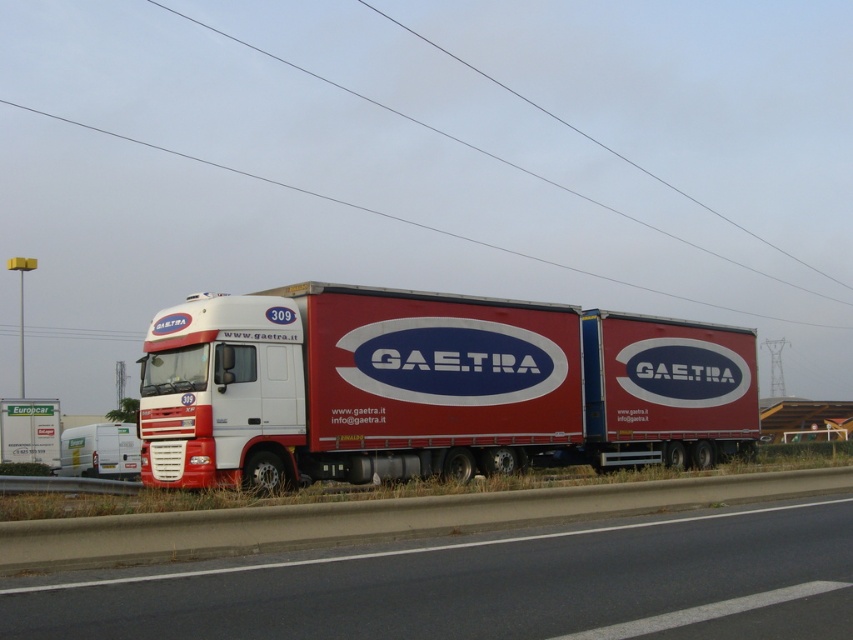
You are a delivery driver who needs to back up your vehicle into a loading dock. You see the red matte trailer truck at center and the white matte trailer at lower left. Which trailer should you back up first to ensure proper alignment with the loading dock?

You should back up the white matte trailer at lower left first because the red matte trailer truck at center is to the right of it, so aligning the white one first will allow better positioning for both trailers.

You are a delivery driver who needs to park your truck without hitting the power lines. Given that your truck is 10 meters long, can you safely park your truck between the red matte trailer truck at center and the blackcablepower line at upper center without touching either?

The distance between the red matte trailer truck at center and the blackcablepower line at upper center is 85.73 meters. Since your truck is only 10 meters long, there is sufficient space to park it between them without touching either.